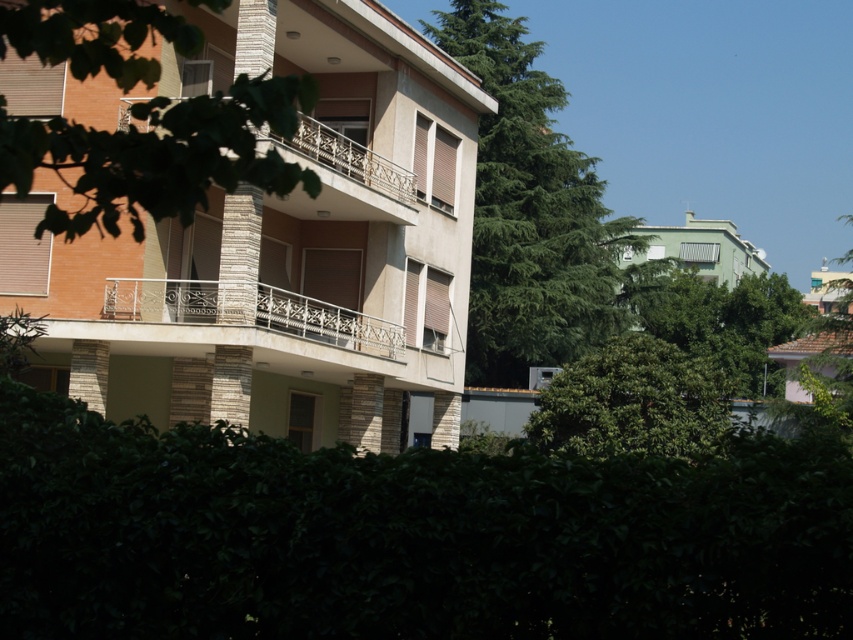
You are standing in front of the residential building and want to take a photo of the stone textured balcony at center without the green leafy tree at upper center blocking it. Which direction should you move to ensure the balcony is visible and the tree is out of frame?

Move to the left so the green leafy tree at upper center, which is to the right of the stone textured balcony at center, moves out of the frame, allowing the balcony to be visible.

You are a landscape architect designing a garden path that needs to pass between the green coniferous tree at center and the green leafy tree at upper center. Based on their heights, which tree should you consider for shade placement?

The green coniferous tree at center is taller than the green leafy tree at upper center, so it would provide more shade. Therefore, you should consider placing shade under the green coniferous tree at center.

You are a photographer planning to capture the residential building with its modern design. You notice the green leafy tree at upper center and the stone textured balcony at center. Which object would you need to focus on more carefully to ensure it appears in sharp detail due to its size?

The stone textured balcony at center is larger than the green leafy tree at upper center, so you should focus more on the stone textured balcony at center to ensure its details are captured sharply.